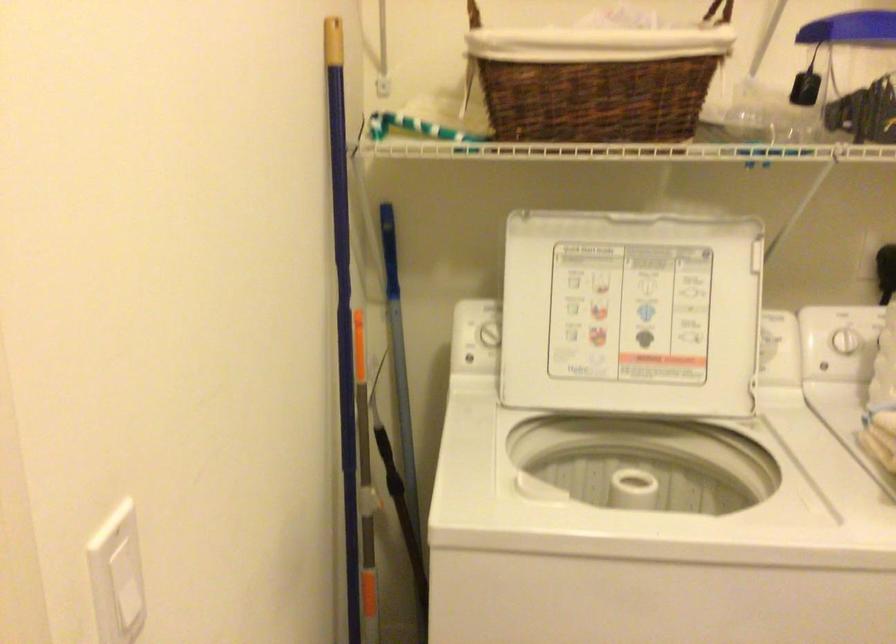
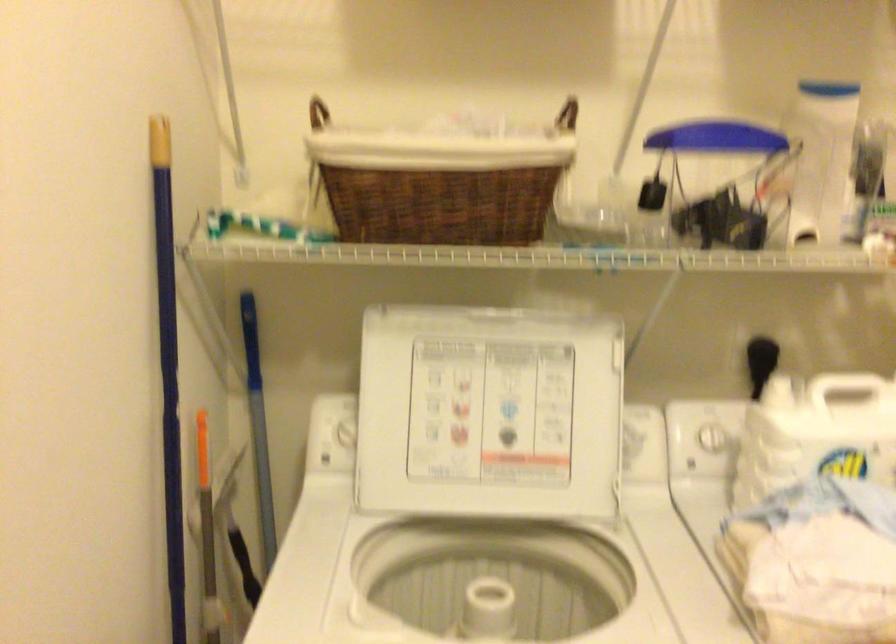
In the second image, find the point that corresponds to point 627,313 in the first image.

(488, 413)